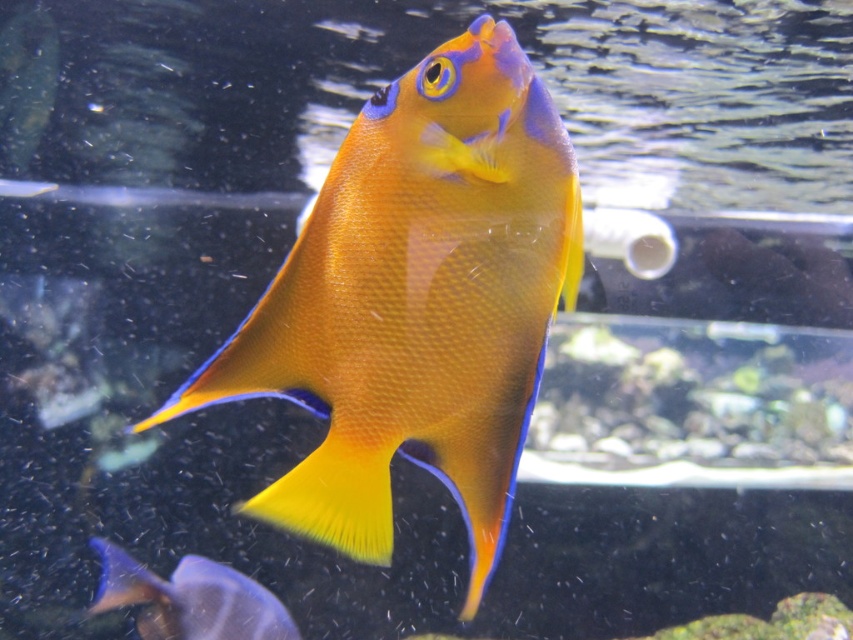
Can you confirm if matte orange fish at center is bigger than blue glossy fish at lower left?

No, matte orange fish at center is not bigger than blue glossy fish at lower left.

Is point (525, 280) closer to viewer compared to point (263, 609)?

Yes.

The height and width of the screenshot is (640, 853). I want to click on matte orange fish at center, so click(416, 301).